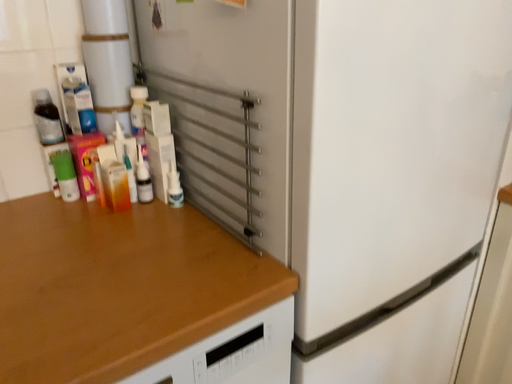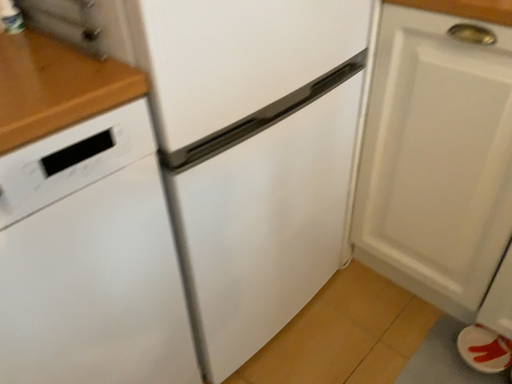
Question: Which way did the camera rotate in the video?

Choices:
 (A) rotated upward
 (B) rotated downward

Answer: (B)